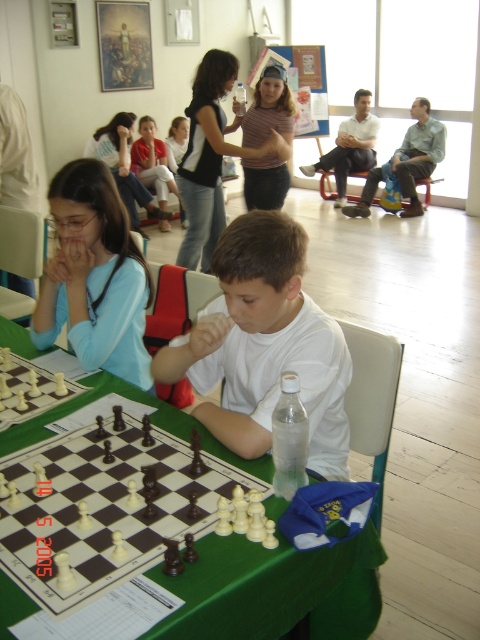
Question: From the image, what is the correct spatial relationship of green fabric table at center in relation to light blue fabric shirt at upper left?

Choices:
 (A) right
 (B) left

Answer: (A)

Question: Which point is closer to the camera taking this photo?

Choices:
 (A) (443, 129)
 (B) (260, 602)
 (C) (252, 108)
 (D) (151, 538)

Answer: (B)

Question: Which object appears farthest from the camera in this image?

Choices:
 (A) light blue fabric shirt at upper left
 (B) white plastic chess set at center

Answer: (A)

Question: Among these objects, which one is nearest to the camera?

Choices:
 (A) matte blue shirt at left
 (B) green fabric table at center
 (C) white plastic chess pieces at center

Answer: (B)

Question: Can you confirm if white matte shirt at center is positioned below matte blue shirt at left?

Choices:
 (A) yes
 (B) no

Answer: (A)

Question: Does green fabric table at center have a smaller size compared to light blue fabric shirt at upper left?

Choices:
 (A) no
 (B) yes

Answer: (B)